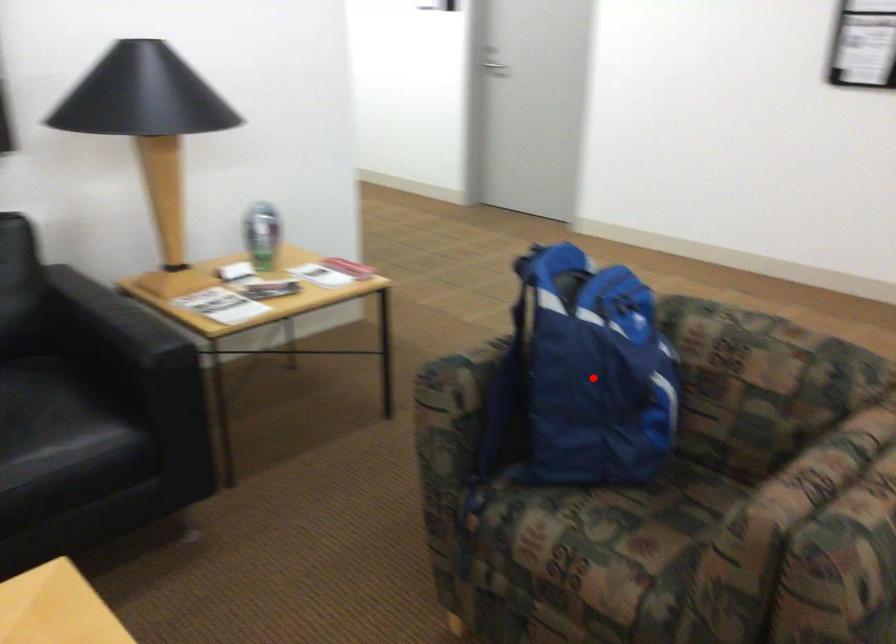
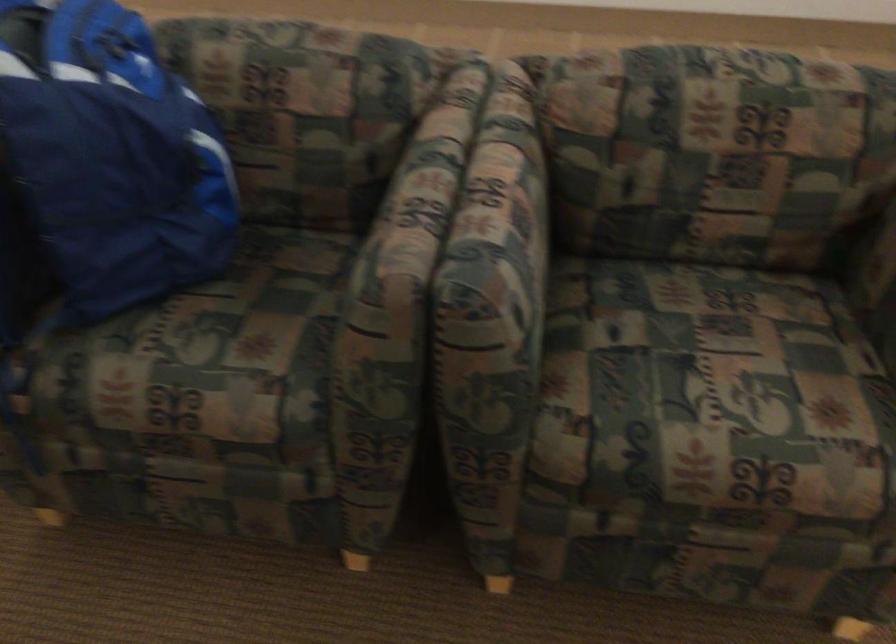
Question: I am providing you with two images of the same scene from different viewpoints. A red point is marked on the first image. Is the red point's position out of view in image 2?

Choices:
 (A) Yes
 (B) No

Answer: (B)